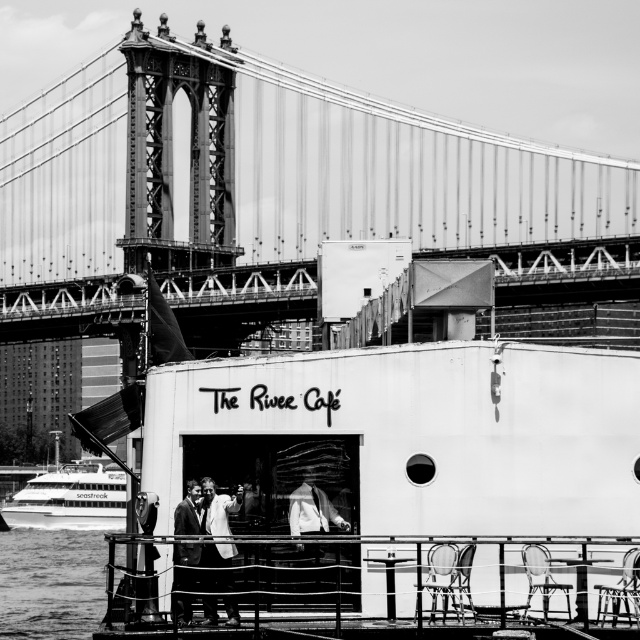
Question: Is metallic bridge at upper center wider than white fabric at center?

Choices:
 (A) yes
 (B) no

Answer: (A)

Question: Among these points, which one is nearest to the camera?

Choices:
 (A) (72, 634)
 (B) (188, 525)
 (C) (163, 52)
 (D) (212, 579)

Answer: (D)

Question: Can you confirm if metallic bridge at upper center is thinner than white fabric at center?

Choices:
 (A) no
 (B) yes

Answer: (A)

Question: Can you confirm if metallic bridge at upper center is positioned to the right of white fabric coat at center?

Choices:
 (A) no
 (B) yes

Answer: (B)

Question: Which point is farther to the camera?

Choices:
 (A) (301, 525)
 (B) (230, 620)
 (C) (147, 38)

Answer: (C)

Question: Which point is closer to the camera?

Choices:
 (A) metallic bridge at upper center
 (B) white fabric at center
 (C) white fabric coat at center
 (D) smooth leather jacket at center

Answer: (D)